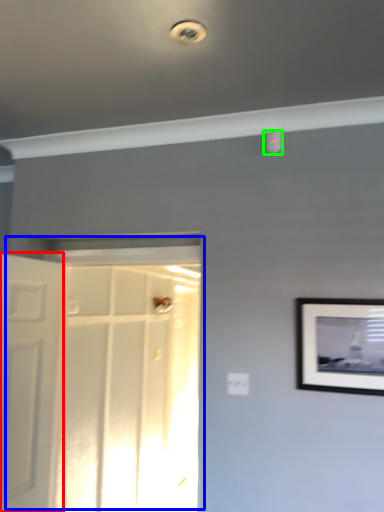
Question: Considering the real-world distances, which object is farthest from door (highlighted by a red box)? door (highlighted by a blue box) or droplight (highlighted by a green box)?

Choices:
 (A) door
 (B) droplight

Answer: (B)